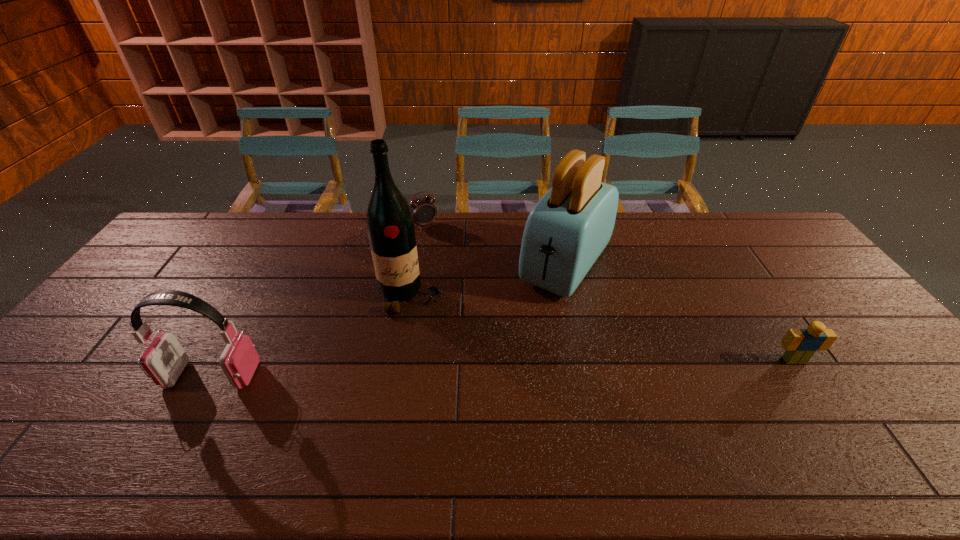
Locate an element on the screen. Image resolution: width=960 pixels, height=540 pixels. toaster situated at the far edge is located at coordinates tap(566, 231).

The image size is (960, 540). Find the location of `alarm clock at the far edge`. alarm clock at the far edge is located at coordinates (424, 212).

This screenshot has width=960, height=540. Find the location of `free space at the far edge`. free space at the far edge is located at coordinates (252, 247).

Locate an element on the screen. The image size is (960, 540). free location at the near edge of the desktop is located at coordinates click(x=538, y=396).

The width and height of the screenshot is (960, 540). I want to click on blank area at the left edge, so click(x=62, y=392).

Image resolution: width=960 pixels, height=540 pixels. What are the coordinates of `vacant space at the right edge` in the screenshot? It's located at (807, 295).

Find the location of a particular element. The width and height of the screenshot is (960, 540). empty location between the rightmost object and the alarm clock is located at coordinates (609, 292).

Locate an element on the screen. free area in between the alarm clock and the leftmost object is located at coordinates (318, 300).

The width and height of the screenshot is (960, 540). Find the location of `free space that is in between the earphone and the farthest object`. free space that is in between the earphone and the farthest object is located at coordinates (318, 300).

At what (x,y) coordinates should I click in order to perform the action: click on free spot between the wine bottle and the third shortest object. Please return your answer as a coordinate pair (x, y). Image resolution: width=960 pixels, height=540 pixels. Looking at the image, I should click on (311, 335).